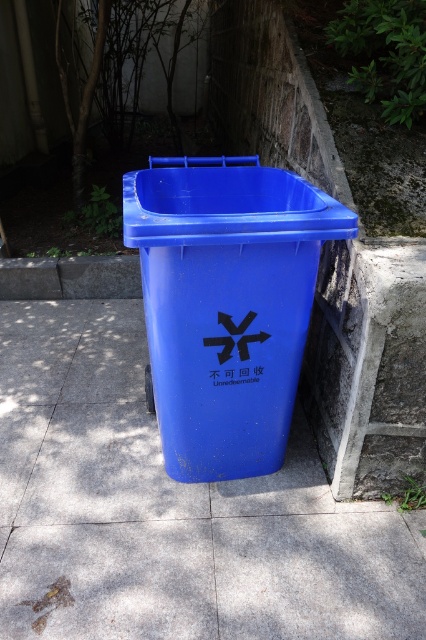
Question: Does blue plastic trash can at center have a larger size compared to matte plastic trash can at center?

Choices:
 (A) no
 (B) yes

Answer: (B)

Question: Does blue plastic trash can at center have a lesser width compared to matte plastic trash can at center?

Choices:
 (A) yes
 (B) no

Answer: (B)

Question: Among these points, which one is nearest to the camera?

Choices:
 (A) (77, 333)
 (B) (294, 349)

Answer: (B)

Question: Among these objects, which one is nearest to the camera?

Choices:
 (A) blue plastic trash can at center
 (B) matte plastic trash can at center

Answer: (B)

Question: Is blue plastic trash can at center smaller than matte plastic trash can at center?

Choices:
 (A) no
 (B) yes

Answer: (A)

Question: Which point is closer to the camera?

Choices:
 (A) (22, 305)
 (B) (192, 477)

Answer: (B)